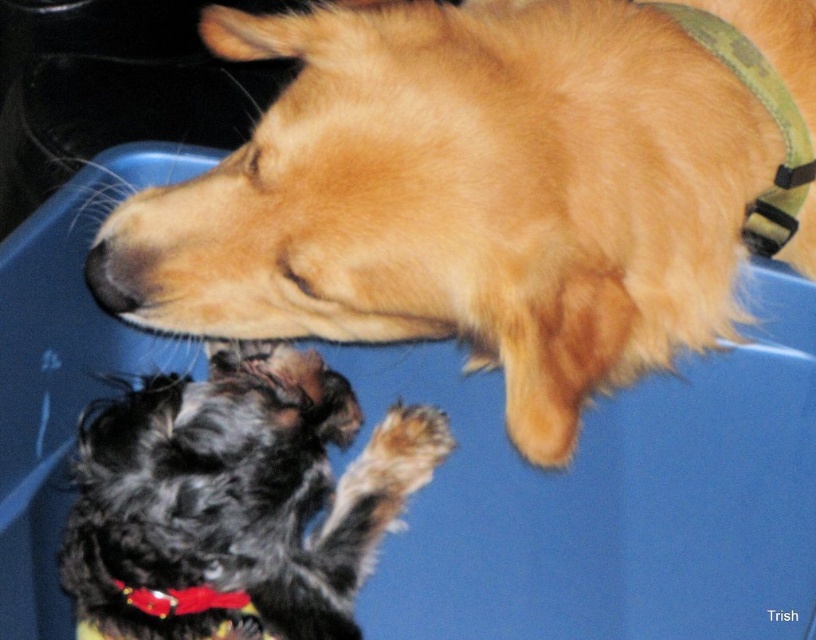
Question: Is golden fur dog at upper center in front of red fabric neckband at lower center?

Choices:
 (A) no
 (B) yes

Answer: (B)

Question: Observing the image, what is the correct spatial positioning of shiny black fur at lower left in reference to red fabric neckband at lower center?

Choices:
 (A) below
 (B) above

Answer: (B)

Question: Which point is farther to the camera?

Choices:
 (A) (154, 218)
 (B) (173, 602)
 (C) (83, 488)

Answer: (B)

Question: In this image, where is shiny black fur at lower left located relative to red fabric neckband at lower center?

Choices:
 (A) right
 (B) left

Answer: (A)

Question: Which object is positioned farthest from the golden fur dog at upper center?

Choices:
 (A) red fabric neckband at lower center
 (B) shiny black fur at lower left

Answer: (A)

Question: Which point is farther to the camera?

Choices:
 (A) shiny black fur at lower left
 (B) golden fur dog at upper center

Answer: (A)